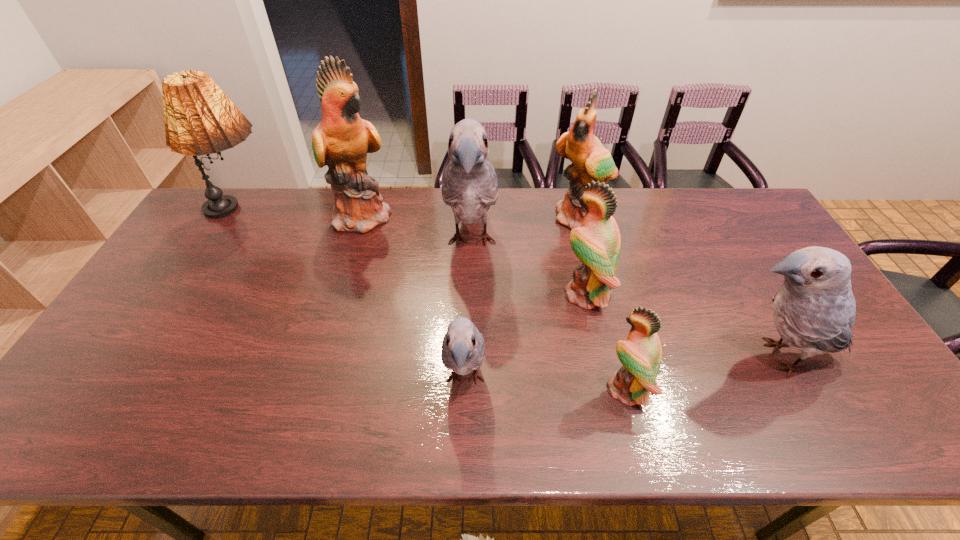
Select which object appears as the sixth closest to the second biggest green parrot. Please provide its 2D coordinates. Your answer should be formatted as a tuple, i.e. [(x, y)], where the tuple contains the x and y coordinates of a point satisfying the conditions above.

[(342, 139)]

At what (x,y) coordinates should I click in order to perform the action: click on parrot that is the third closest one to the second smallest gray parrot. Please return your answer as a coordinate pair (x, y). Looking at the image, I should click on (590, 160).

Where is `the closest parrot to the second smallest green parrot`? The image size is (960, 540). the closest parrot to the second smallest green parrot is located at coordinates (640, 354).

At what (x,y) coordinates should I click in order to perform the action: click on green parrot that can be found as the second closest to the second biggest green parrot. Please return your answer as a coordinate pair (x, y). Looking at the image, I should click on (640, 354).

Identify which green parrot is located as the second nearest to the nearest green parrot. Please provide its 2D coordinates. Your answer should be formatted as a tuple, i.e. [(x, y)], where the tuple contains the x and y coordinates of a point satisfying the conditions above.

[(590, 160)]

You are a GUI agent. You are given a task and a screenshot of the screen. Output one action in this format:
    pyautogui.click(x=<x>, y=<y>)
    Task: Click on the gray parrot that is the second closest one to the smallest gray parrot
    The height and width of the screenshot is (540, 960).
    Given the screenshot: What is the action you would take?
    pyautogui.click(x=814, y=310)

Locate an element on the screen. Image resolution: width=960 pixels, height=540 pixels. gray parrot identified as the closest to the farthest gray parrot is located at coordinates (463, 349).

The width and height of the screenshot is (960, 540). Identify the location of free spot that satisfies the following two spatial constraints: 1. on the front-facing side of the rightmost object; 2. on the front-facing side of the smallest gray parrot. (789, 380).

Locate an element on the screen. The height and width of the screenshot is (540, 960). vacant area in the image that satisfies the following two spatial constraints: 1. on the front-facing side of the second smallest green parrot; 2. on the front-facing side of the smallest gray parrot is located at coordinates (605, 380).

Find the location of a particular element. vacant space that satisfies the following two spatial constraints: 1. on the front-facing side of the second smallest green parrot; 2. on the front-facing side of the smallest gray parrot is located at coordinates (605, 380).